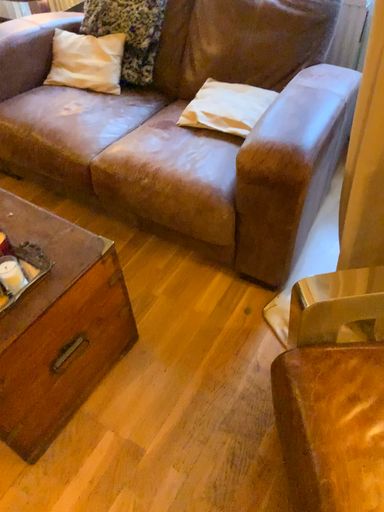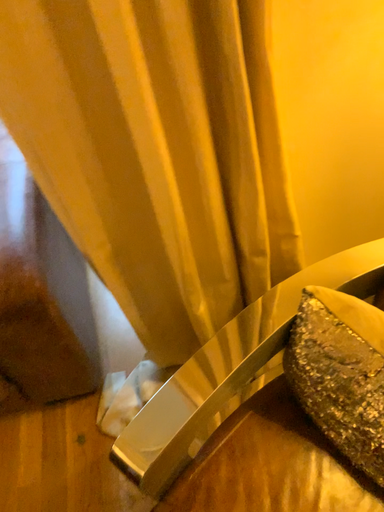
Question: Which way did the camera rotate in the video?

Choices:
 (A) rotated left
 (B) rotated right

Answer: (B)